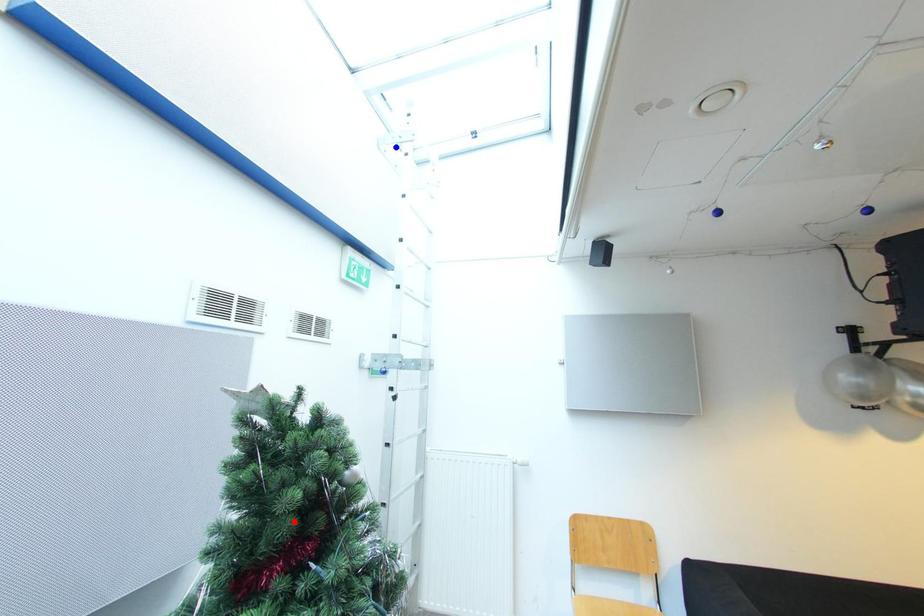
Question: In the image, two points are highlighted. Which point is nearer to the camera? Reply with the corresponding letter.

Choices:
 (A) blue point
 (B) red point

Answer: (B)